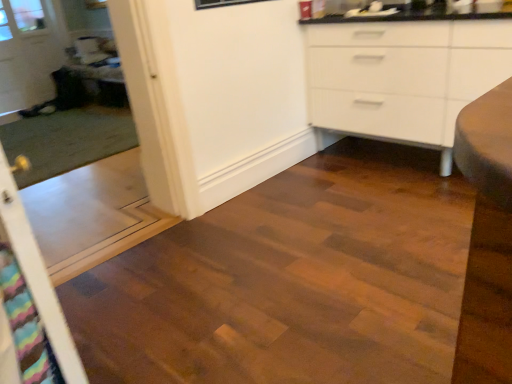
Describe the element at coordinates (101, 83) in the screenshot. This screenshot has height=384, width=512. I see `wooden table at left` at that location.

Image resolution: width=512 pixels, height=384 pixels. Find the location of `wooden table at left`. wooden table at left is located at coordinates (101, 83).

I want to click on transparent glass door at upper left, so click(29, 52).

The width and height of the screenshot is (512, 384). What are the coordinates of `multicolored fabric screen door at left, acting as the 2th screen door starting from the back` in the screenshot? It's located at (37, 274).

Locate an element on the screen. wooden table at left is located at coordinates (101, 83).

Considering the positions of objects multicolored fabric screen door at left, acting as the 2th screen door starting from the back, and wooden table at left in the image provided, who is more to the left, multicolored fabric screen door at left, acting as the 2th screen door starting from the back, or wooden table at left?

From the viewer's perspective, wooden table at left appears more on the left side.

Is multicolored fabric screen door at left, acting as the 2th screen door starting from the back, aimed at wooden table at left?

No, multicolored fabric screen door at left, acting as the 2th screen door starting from the back, does not turn towards wooden table at left.

Is point (10, 214) positioned behind point (96, 102)?

That is False.

Which object is thinner, multicolored fabric screen door at left, acting as the 2th screen door starting from the back, or wooden table at left?

multicolored fabric screen door at left, acting as the 2th screen door starting from the back, is thinner.

Choose the correct answer: Is transparent glass door at upper left inside wooden table at left or outside it?

transparent glass door at upper left is spatially situated outside wooden table at left.

In the scene shown: Between transparent glass door at upper left and wooden table at left, which one has smaller size?

transparent glass door at upper left is smaller.

Is transparent glass door at upper left looking in the opposite direction of wooden table at left?

No, transparent glass door at upper left's orientation is not away from wooden table at left.

From the picture: Which point is more distant from viewer, (8, 50) or (123, 91)?

The point (123, 91) is more distant.

Between transparent glass door at upper left and transparent plastic screen door at left, the 2th screen door from the front, which one has smaller size?

transparent glass door at upper left is smaller.

How different are the orientations of transparent glass door at upper left and transparent plastic screen door at left, which appears as the 1th screen door when viewed from the back, in degrees?

The facing directions of transparent glass door at upper left and transparent plastic screen door at left, which appears as the 1th screen door when viewed from the back, are 0.517 degrees apart.

From a real-world perspective, which is physically below, transparent glass door at upper left or transparent plastic screen door at left, which appears as the 1th screen door when viewed from the back?

transparent plastic screen door at left, which appears as the 1th screen door when viewed from the back.

From the image's perspective, is transparent plastic screen door at left, which appears as the 1th screen door when viewed from the back, on top of transparent glass door at upper left?

No, from the image's perspective, transparent plastic screen door at left, which appears as the 1th screen door when viewed from the back, is not on top of transparent glass door at upper left.

Is transparent plastic screen door at left, the 2th screen door from the front, positioned beyond the bounds of transparent glass door at upper left?

Absolutely, transparent plastic screen door at left, the 2th screen door from the front, is external to transparent glass door at upper left.

Measure the distance between transparent plastic screen door at left, which appears as the 1th screen door when viewed from the back, and transparent glass door at upper left.

They are 18.96 inches apart.

Which is less distant, (75,267) or (20,97)?

Point (75,267).

Is transparent plastic screen door at left, which appears as the 1th screen door when viewed from the back, oriented away from wooden table at left?

transparent plastic screen door at left, which appears as the 1th screen door when viewed from the back, does not have its back to wooden table at left.

Considering the sizes of transparent plastic screen door at left, which appears as the 1th screen door when viewed from the back, and wooden table at left in the image, is transparent plastic screen door at left, which appears as the 1th screen door when viewed from the back, taller or shorter than wooden table at left?

Considering their sizes, transparent plastic screen door at left, which appears as the 1th screen door when viewed from the back, has more height than wooden table at left.

Between transparent plastic screen door at left, which appears as the 1th screen door when viewed from the back, and wooden table at left, which one has smaller width?

transparent plastic screen door at left, which appears as the 1th screen door when viewed from the back, is thinner.

From the image's perspective, which one is positioned higher, transparent plastic screen door at left, which appears as the 1th screen door when viewed from the back, or wooden table at left?

wooden table at left appears higher in the image.

Is multicolored fabric screen door at left, which is the first screen door from front to back, facing away from transparent plastic screen door at left, which appears as the 1th screen door when viewed from the back?

No.

Image resolution: width=512 pixels, height=384 pixels. In the image, there is a transparent plastic screen door at left, the 2th screen door from the front. Find the location of `screen door below it (from a real-world perspective)`. screen door below it (from a real-world perspective) is located at coordinates (37, 274).

Which is more to the left, multicolored fabric screen door at left, which is the first screen door from front to back, or transparent plastic screen door at left, which appears as the 1th screen door when viewed from the back?

transparent plastic screen door at left, which appears as the 1th screen door when viewed from the back, is more to the left.

From a real-world perspective, between multicolored fabric screen door at left, acting as the 2th screen door starting from the back, and transparent plastic screen door at left, which appears as the 1th screen door when viewed from the back, who is vertically higher?

In real-world perspective, transparent plastic screen door at left, which appears as the 1th screen door when viewed from the back, is above.

This screenshot has width=512, height=384. I want to click on glass door on the left side of wooden table at left, so click(29, 52).

Measure the distance from wooden table at left to transparent glass door at upper left.

They are 24.61 inches apart.

Is wooden table at left bigger than transparent glass door at upper left?

Correct, wooden table at left is larger in size than transparent glass door at upper left.

Is wooden table at left oriented away from transparent glass door at upper left?

No, transparent glass door at upper left is not at the back of wooden table at left.

From a real-world perspective, starting from the wooden table at left, which screen door is the 1st one vertically above it? Please provide its 2D coordinates.

[(37, 274)]

Where is `glass door on the left of wooden table at left`? glass door on the left of wooden table at left is located at coordinates (29, 52).

From the image, which object appears to be nearer to transparent glass door at upper left, transparent plastic screen door at left, which appears as the 1th screen door when viewed from the back, or wooden table at left?

transparent plastic screen door at left, which appears as the 1th screen door when viewed from the back, lies closer to transparent glass door at upper left than the other object.

Based on their spatial positions, is wooden table at left or transparent glass door at upper left further from multicolored fabric screen door at left, which is the first screen door from front to back?

Based on the image, transparent glass door at upper left appears to be further to multicolored fabric screen door at left, which is the first screen door from front to back.

Based on their spatial positions, is multicolored fabric screen door at left, acting as the 2th screen door starting from the back, or transparent plastic screen door at left, the 2th screen door from the front, closer to transparent glass door at upper left?

Based on the image, transparent plastic screen door at left, the 2th screen door from the front, appears to be nearer to transparent glass door at upper left.

From the image, which object appears to be nearer to wooden table at left, transparent plastic screen door at left, the 2th screen door from the front, or transparent glass door at upper left?

transparent glass door at upper left.

Considering their positions, is multicolored fabric screen door at left, acting as the 2th screen door starting from the back, positioned further to transparent plastic screen door at left, which appears as the 1th screen door when viewed from the back, than transparent glass door at upper left?

multicolored fabric screen door at left, acting as the 2th screen door starting from the back, is positioned further to the anchor transparent plastic screen door at left, which appears as the 1th screen door when viewed from the back.

Which object lies further to the anchor point transparent glass door at upper left, wooden table at left or transparent plastic screen door at left, which appears as the 1th screen door when viewed from the back?

The object further to transparent glass door at upper left is wooden table at left.

When comparing their distances from multicolored fabric screen door at left, which is the first screen door from front to back, does transparent plastic screen door at left, which appears as the 1th screen door when viewed from the back, or transparent glass door at upper left seem further?

transparent glass door at upper left.

Based on their spatial positions, is transparent glass door at upper left or transparent plastic screen door at left, which appears as the 1th screen door when viewed from the back, further from multicolored fabric screen door at left, acting as the 2th screen door starting from the back?

Based on the image, transparent glass door at upper left appears to be further to multicolored fabric screen door at left, acting as the 2th screen door starting from the back.

Image resolution: width=512 pixels, height=384 pixels. I want to click on screen door between multicolored fabric screen door at left, which is the first screen door from front to back, and wooden table at left, along the z-axis, so click(x=74, y=148).

Image resolution: width=512 pixels, height=384 pixels. In order to click on table between transparent plastic screen door at left, the 2th screen door from the front, and transparent glass door at upper left in the front-back direction in this screenshot , I will do `click(101, 83)`.

Locate an element on the screen. This screenshot has width=512, height=384. screen door between multicolored fabric screen door at left, acting as the 2th screen door starting from the back, and transparent glass door at upper left from front to back is located at coordinates (74, 148).

I want to click on table located between multicolored fabric screen door at left, which is the first screen door from front to back, and transparent glass door at upper left in the depth direction, so [x=101, y=83].